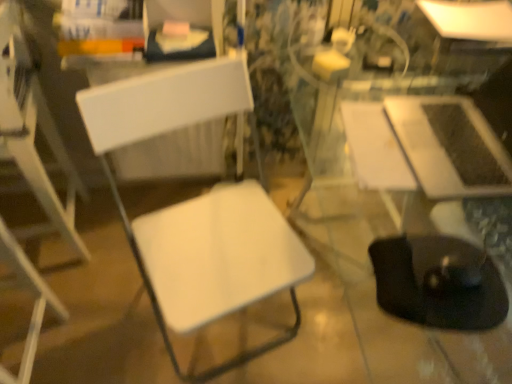
I want to click on free space between white matte chair at left, marked as the 1th chair in a right-to-left arrangement, and white plastic chair at left, the 1th chair when ordered from left to right, so click(x=114, y=328).